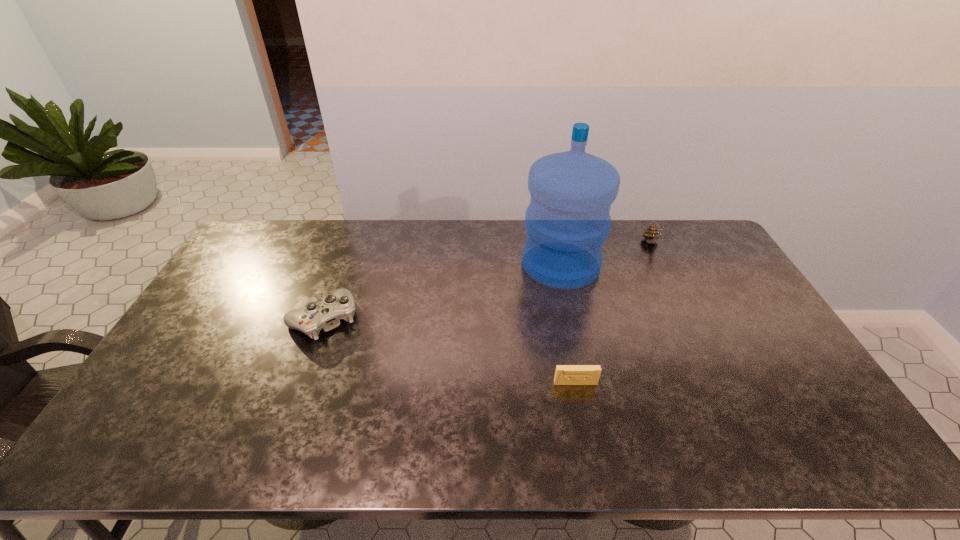
This screenshot has width=960, height=540. In order to click on free space between the second shortest object and the water jug in this screenshot , I will do coord(443,292).

Image resolution: width=960 pixels, height=540 pixels. What are the coordinates of `free spot between the water jug and the second shortest object` in the screenshot? It's located at (443, 292).

Where is `blank region between the water jug and the rightmost object`? blank region between the water jug and the rightmost object is located at coordinates (607, 254).

In order to click on empty space that is in between the tallest object and the nearest object in this screenshot , I will do `click(568, 323)`.

The width and height of the screenshot is (960, 540). Find the location of `empty location between the water jug and the rightmost object`. empty location between the water jug and the rightmost object is located at coordinates (607, 254).

Image resolution: width=960 pixels, height=540 pixels. What are the coordinates of `free spot between the snail and the second nearest object` in the screenshot? It's located at (488, 281).

Image resolution: width=960 pixels, height=540 pixels. What are the coordinates of `free space between the leftmost object and the rightmost object` in the screenshot? It's located at (488, 281).

Where is `vacant area that lies between the water jug and the snail`? The width and height of the screenshot is (960, 540). vacant area that lies between the water jug and the snail is located at coordinates (607, 254).

What are the coordinates of `vacant region between the tallest object and the videotape` in the screenshot? It's located at (568, 323).

Identify which object is the closest to the water jug. Please provide its 2D coordinates. Your answer should be formatted as a tuple, i.e. [(x, y)], where the tuple contains the x and y coordinates of a point satisfying the conditions above.

[(652, 235)]